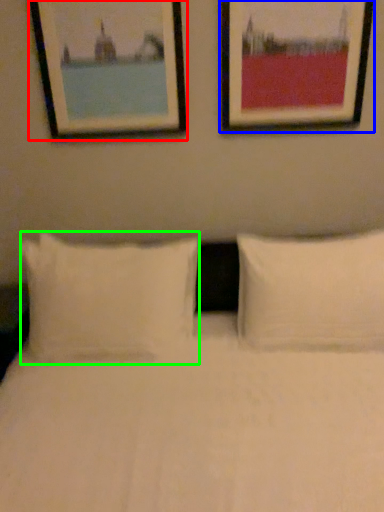
Question: Estimate the real-world distances between objects in this image. Which object is farther from picture frame (highlighted by a red box), picture frame (highlighted by a blue box) or pillow (highlighted by a green box)?

Choices:
 (A) picture frame
 (B) pillow

Answer: (B)